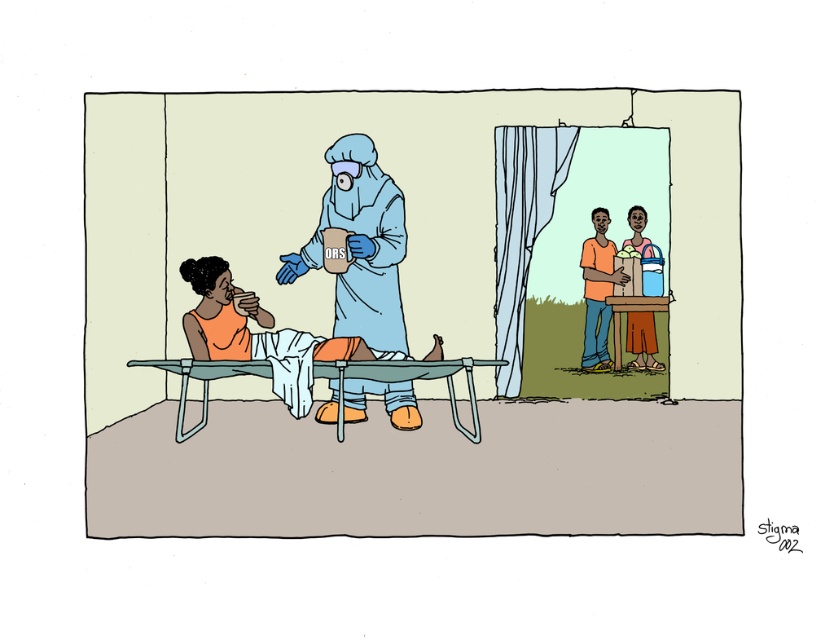
Question: Which object is farther from the camera taking this photo?

Choices:
 (A) orange cotton shirt at center
 (B) blue protective suit at center
 (C) orange fabric patient at center
 (D) matte plastic cup at center

Answer: (A)

Question: Is matte plastic cup at center wider than orange fabric patient at center?

Choices:
 (A) no
 (B) yes

Answer: (A)

Question: Among these objects, which one is farthest from the camera?

Choices:
 (A) orange cotton shirt at center
 (B) orange fabric patient at center
 (C) matte plastic cup at center
 (D) blue protective suit at center

Answer: (A)

Question: Can you confirm if blue protective suit at center is smaller than orange cotton shirt at center?

Choices:
 (A) yes
 (B) no

Answer: (B)

Question: Does orange fabric patient at center appear under orange cotton shirt at center?

Choices:
 (A) no
 (B) yes

Answer: (B)

Question: Which object is closer to the camera taking this photo?

Choices:
 (A) orange cotton shirt at center
 (B) orange fabric patient at center
 (C) blue protective suit at center

Answer: (B)